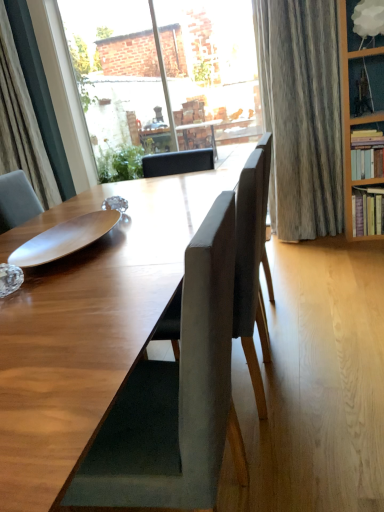
Question: From a real-world perspective, is hardcover books at right, the 1th shelf from the bottom, above or below suede-like gray chair at center, marked as the 1th chair in a back-to-front arrangement?

Choices:
 (A) above
 (B) below

Answer: (B)

Question: Considering the relative positions of hardcover books at right, the 1th shelf from the bottom, and suede-like gray chair at center, which ranks as the second chair in front-to-back order, in the image provided, is hardcover books at right, the 1th shelf from the bottom, to the left or to the right of suede-like gray chair at center, which ranks as the second chair in front-to-back order,?

Choices:
 (A) left
 (B) right

Answer: (B)

Question: Considering the real-world distances, which object is closest to the suede-like gray chair at center, which ranks as the second chair in front-to-back order?

Choices:
 (A) matte gray chair at center, acting as the 1th chair starting from the front
 (B) hardwood bookshelf at right, which appears as the second shelf when ordered from the bottom
 (C) white cloud lampshade at upper right, marked as the 3th shelf in a bottom-to-top arrangement
 (D) green leafy plant at center
 (E) wooden plate at center

Answer: (A)

Question: Estimate the real-world distances between objects in this image. Which object is farther from the white cloud lampshade at upper right, marked as the 3th shelf in a bottom-to-top arrangement?

Choices:
 (A) clear glass window at upper center
 (B) matte gray chair at center, acting as the 1th chair starting from the front
 (C) green leafy plant at center
 (D) hardcover books at right, which is the 3th shelf in top-to-bottom order
 (E) suede-like gray chair at center, which ranks as the second chair in front-to-back order

Answer: (B)